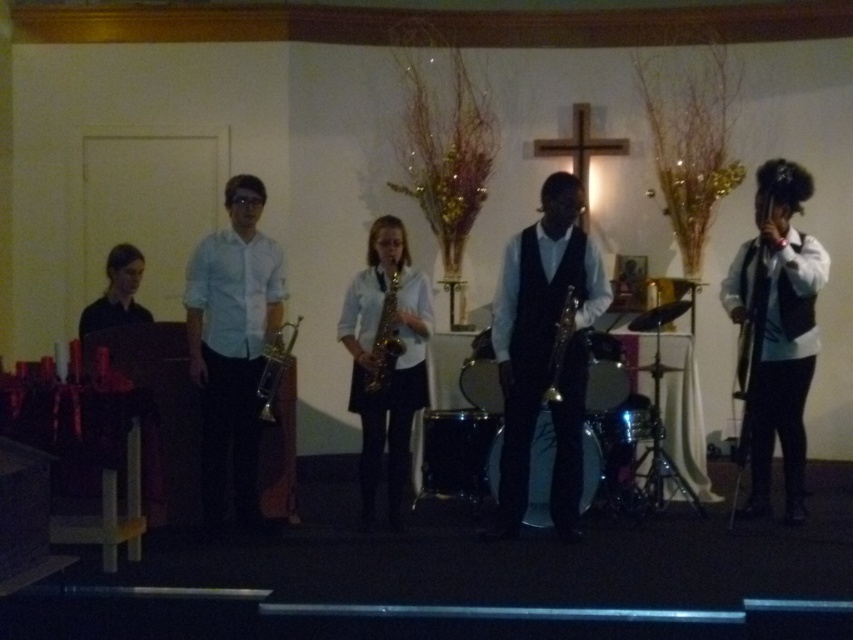
You are a stagehand adjusting the lighting during the performance. You notice the black satin vest at center and the gold shiny saxophone at center. Which object is closer to the audience? Please explain your reasoning based on their positions.

The black satin vest at center is positioned over the gold shiny saxophone at center, meaning it is closer to the audience since it is layered in front of the saxophone.

Based on the scene description, which object is taller between the white glossy shirt at center and the shiny silver saxophone at center?

The white glossy shirt at center is taller than the shiny silver saxophone at center.

You are a photographer at the back of the stage. You want to take a photo of the black satin vest at center and the gold shiny saxophone at center. Can you fit both in the frame if your camera has a 1.5 meter height limit?

The black satin vest at center is taller than the gold shiny saxophone at center. Since the camera has a 1.5 meter height limit, you need to check if the combined height of both objects exceeds this limit. However, the exact heights are not provided, so it is uncertain whether they can fit within the frame.